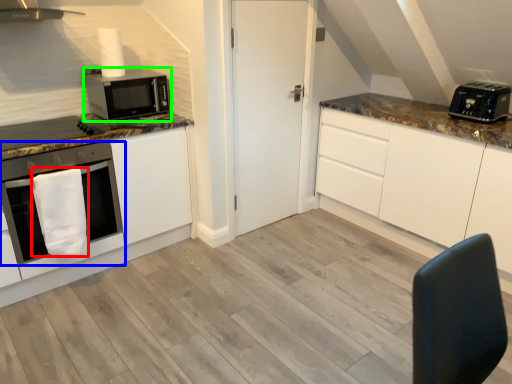
Question: Considering the real-world distances, which object is farthest from hand towel (highlighted by a red box)? oven (highlighted by a blue box) or microwave oven (highlighted by a green box)?

Choices:
 (A) oven
 (B) microwave oven

Answer: (B)